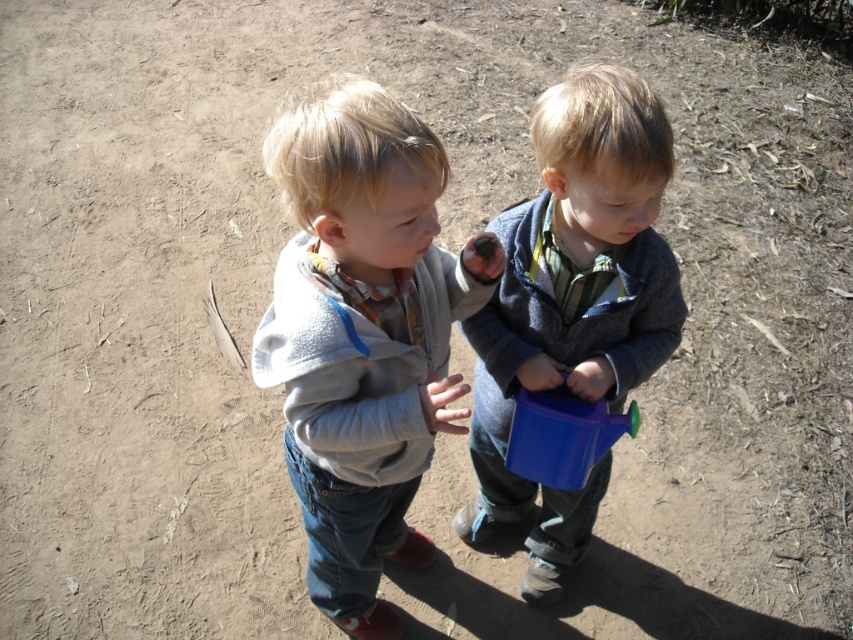
Question: Among these points, which one is nearest to the camera?

Choices:
 (A) (657, 161)
 (B) (357, 426)

Answer: (A)

Question: Is light gray fleece jacket at center smaller than blue plastic watering can at center?

Choices:
 (A) yes
 (B) no

Answer: (B)

Question: Which of the following is the farthest from the observer?

Choices:
 (A) light gray fleece jacket at center
 (B) blue plastic watering can at center

Answer: (B)

Question: Is light gray fleece jacket at center to the right of blue plastic watering can at center from the viewer's perspective?

Choices:
 (A) yes
 (B) no

Answer: (B)

Question: Which point is closer to the camera?

Choices:
 (A) (553, 372)
 (B) (352, 404)

Answer: (B)

Question: Does light gray fleece jacket at center appear on the left side of blue plastic watering can at center?

Choices:
 (A) no
 (B) yes

Answer: (B)